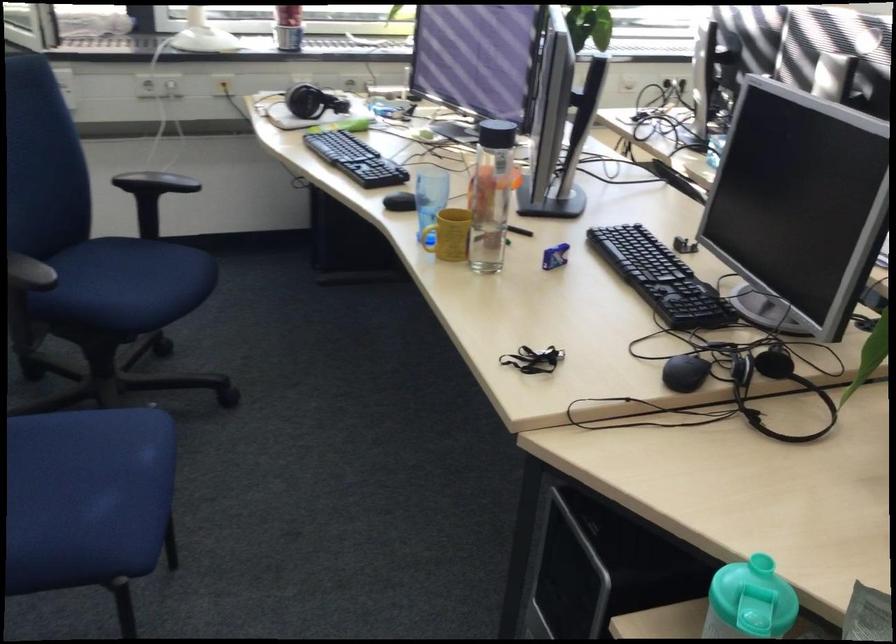
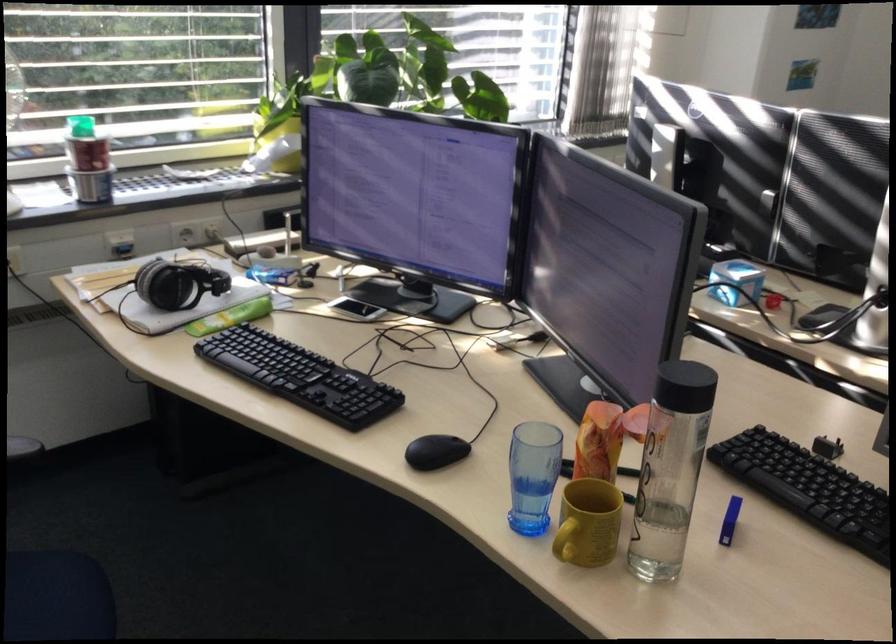
Where in the second image is the point corresponding to pixel 433 242 from the first image?

(564, 547)